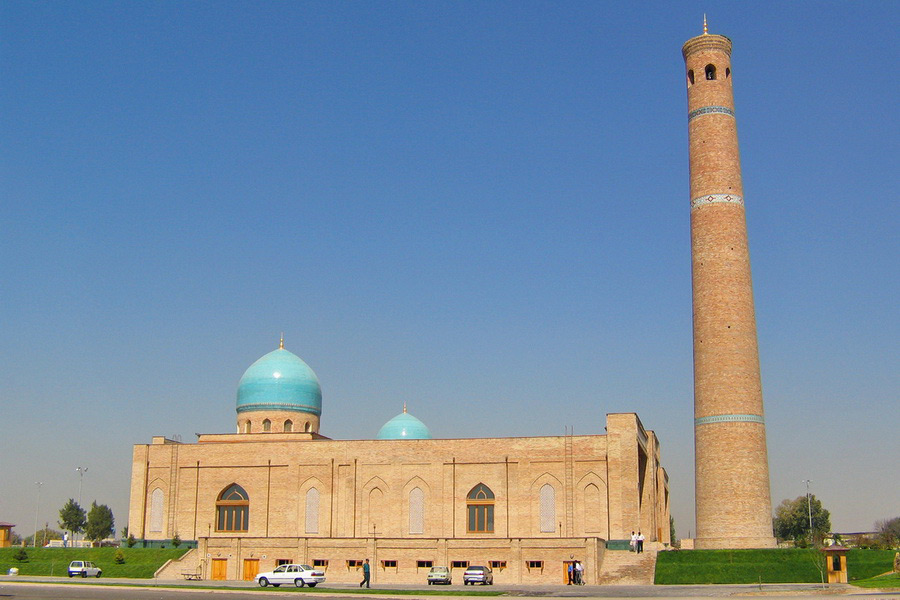
Find the location of `arched windows`. arched windows is located at coordinates (230, 506), (479, 509).